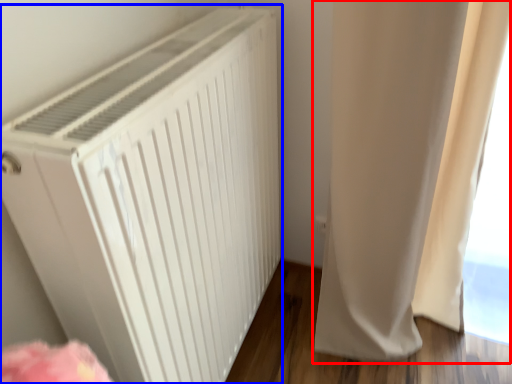
Question: Which point is further to the camera, curtain (highlighted by a red box) or home appliance (highlighted by a blue box)?

Choices:
 (A) curtain
 (B) home appliance

Answer: (A)